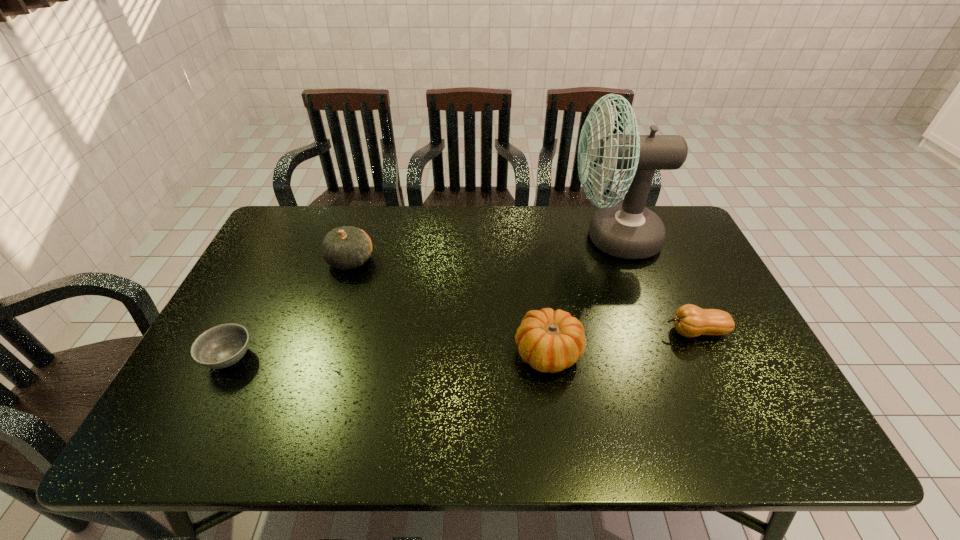
Where is `the tallest object`? The image size is (960, 540). the tallest object is located at coordinates (629, 230).

What are the coordinates of `the farthest gourd` in the screenshot? It's located at (347, 247).

You are a GUI agent. You are given a task and a screenshot of the screen. Output one action in this format:
    pyautogui.click(x=<x>, y=<y>)
    Task: Click on the leftmost gourd
    
    Given the screenshot: What is the action you would take?
    pyautogui.click(x=347, y=247)

Locate an element on the screen. The width and height of the screenshot is (960, 540). the second gourd from left to right is located at coordinates (550, 341).

Identify the location of the second shortest object. Image resolution: width=960 pixels, height=540 pixels. (689, 320).

Locate an element on the screen. Image resolution: width=960 pixels, height=540 pixels. the shortest gourd is located at coordinates (689, 320).

Find the location of `the leftmost object`. the leftmost object is located at coordinates (221, 346).

Locate an element on the screen. the shortest object is located at coordinates (221, 346).

Where is `vacant space situated 0.170m in front of the tallest object where the airflow is directed`? The height and width of the screenshot is (540, 960). vacant space situated 0.170m in front of the tallest object where the airflow is directed is located at coordinates (515, 238).

Locate an element on the screen. vacant space located 0.290m in front of the tallest object where the airflow is directed is located at coordinates (477, 238).